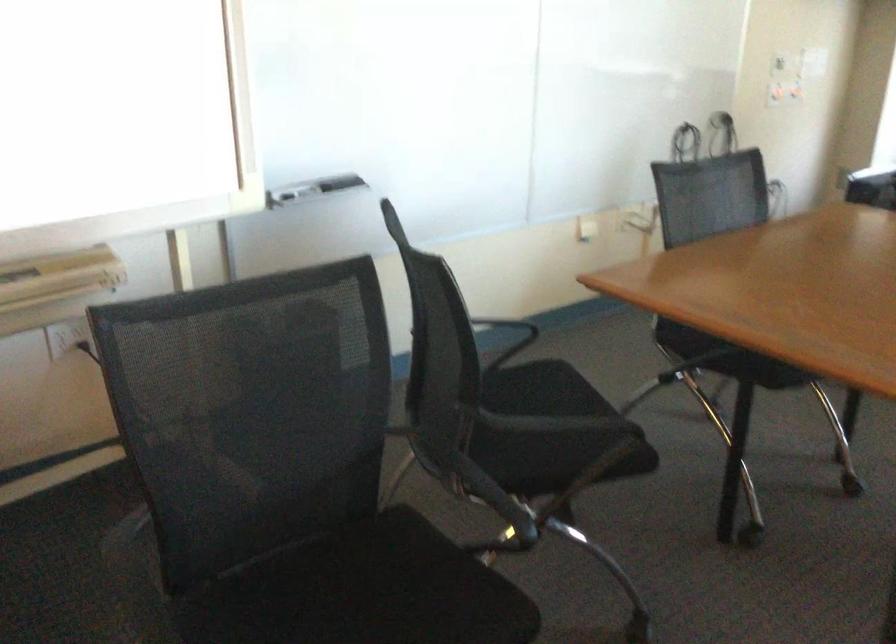
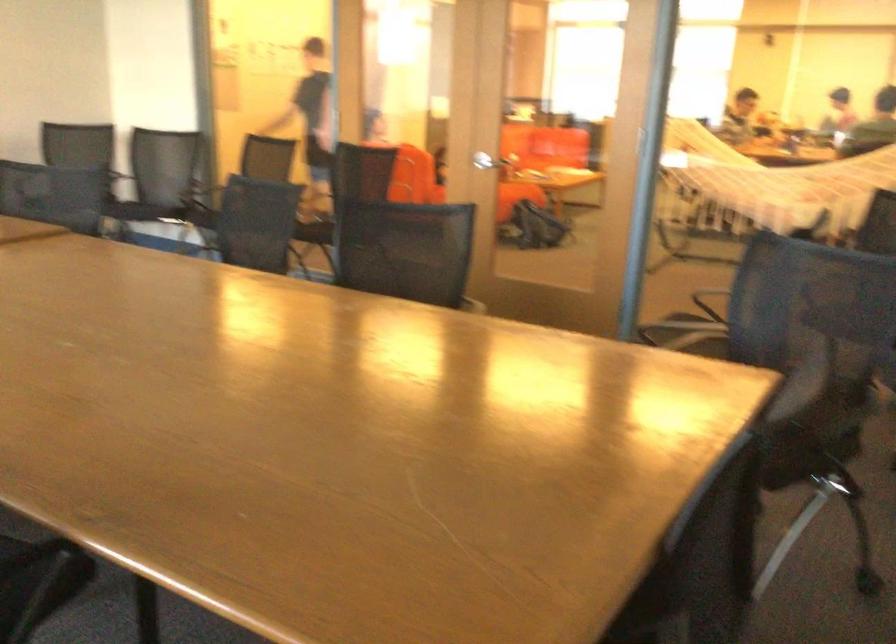
In the second image, find the point that corresponds to [510,380] in the first image.

(803, 453)